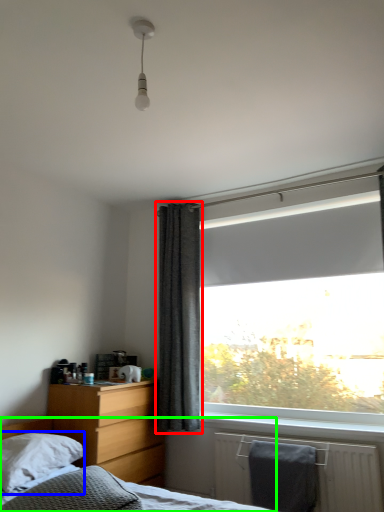
Question: Which is nearer to the curtain (highlighted by a red box)? pillow (highlighted by a blue box) or bed (highlighted by a green box).

Choices:
 (A) pillow
 (B) bed

Answer: (A)